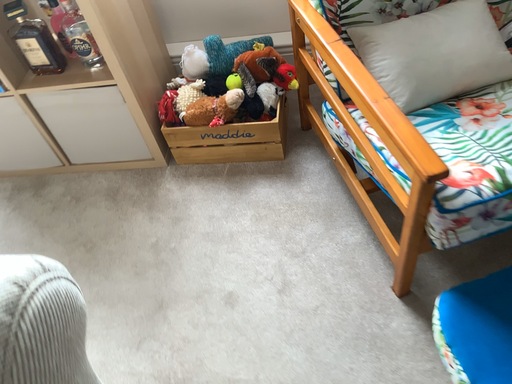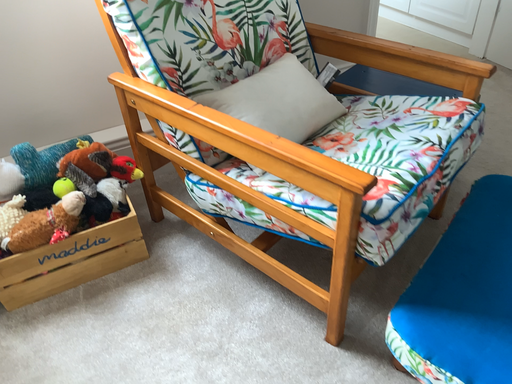
Question: Which way did the camera rotate in the video?

Choices:
 (A) rotated right
 (B) rotated left

Answer: (A)